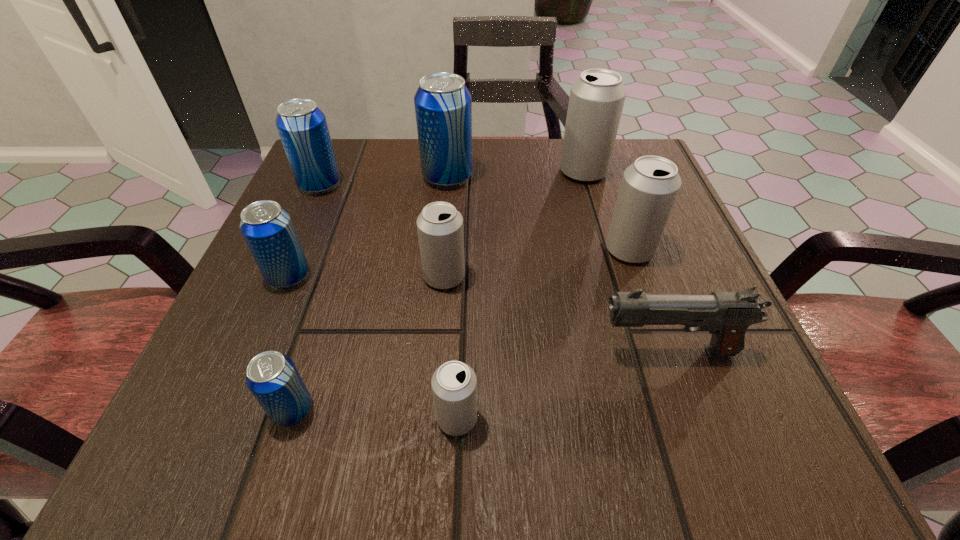
Locate an element on the screen. This screenshot has width=960, height=540. the biggest blue beer can is located at coordinates (443, 105).

I want to click on the farthest white beer can, so click(x=597, y=97).

Where is `the third smallest blue beer can`? The image size is (960, 540). the third smallest blue beer can is located at coordinates (302, 126).

Image resolution: width=960 pixels, height=540 pixels. I want to click on the second biggest white beer can, so click(x=649, y=187).

This screenshot has width=960, height=540. I want to click on the second smallest white beer can, so click(x=440, y=226).

In order to click on the second nearest blue beer can in this screenshot , I will do `click(267, 228)`.

Identify the location of gun. (726, 315).

At what (x,y) coordinates should I click in order to perform the action: click on the seventh farthest object. Please return your answer as a coordinate pair (x, y). Looking at the image, I should click on [726, 315].

Locate an element on the screen. The image size is (960, 540). the third object from left to right is located at coordinates (273, 379).

You are a GUI agent. You are given a task and a screenshot of the screen. Output one action in this format:
    pyautogui.click(x=<x>, y=<y>)
    Task: Click on the third blue beer can from left to right
    
    Given the screenshot: What is the action you would take?
    pyautogui.click(x=273, y=379)